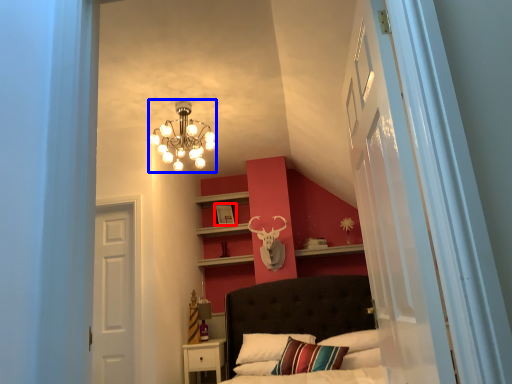
Question: Which point is closer to the camera, picture frame (highlighted by a red box) or lamp (highlighted by a blue box)?

Choices:
 (A) picture frame
 (B) lamp

Answer: (B)